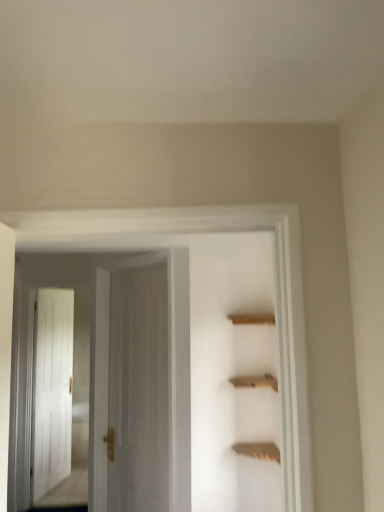
Question: From a real-world perspective, is white wooden door at center, the second door positioned from the back, positioned under wooden shelf at upper center based on gravity?

Choices:
 (A) no
 (B) yes

Answer: (A)

Question: Is white wooden door at center, the second door positioned from the back, far from wooden shelf at upper center?

Choices:
 (A) yes
 (B) no

Answer: (B)

Question: From the image's perspective, would you say white wooden door at center, the second door positioned from the back, is shown under wooden shelf at upper center?

Choices:
 (A) yes
 (B) no

Answer: (B)

Question: Does white wooden door at center, the second door positioned from the back, lie in front of wooden shelf at upper center?

Choices:
 (A) no
 (B) yes

Answer: (B)

Question: Does white wooden door at center, placed as the 1th door when sorted from front to back, have a lesser width compared to wooden shelf at upper center?

Choices:
 (A) no
 (B) yes

Answer: (B)

Question: Does point (231, 382) appear closer or farther from the camera than point (34, 275)?

Choices:
 (A) farther
 (B) closer

Answer: (B)

Question: In terms of width, does wooden shelf at upper center look wider or thinner when compared to white wooden door at center, the second door positioned from the back?

Choices:
 (A) thin
 (B) wide

Answer: (B)

Question: Is wooden shelf at upper center taller or shorter than white wooden door at center, placed as the 1th door when sorted from front to back?

Choices:
 (A) short
 (B) tall

Answer: (A)

Question: Visually, is wooden shelf at upper center positioned to the left or to the right of white wooden door at center, placed as the 1th door when sorted from front to back?

Choices:
 (A) right
 (B) left

Answer: (A)

Question: From their relative heights in the image, would you say white wooden door at center, placed as the 1th door when sorted from front to back, is taller or shorter than wooden shelf at upper center?

Choices:
 (A) short
 (B) tall

Answer: (B)

Question: Considering the positions of white wooden door at center, placed as the 1th door when sorted from front to back, and wooden shelf at upper center in the image, is white wooden door at center, placed as the 1th door when sorted from front to back, wider or thinner than wooden shelf at upper center?

Choices:
 (A) wide
 (B) thin

Answer: (B)

Question: From a real-world perspective, relative to wooden shelf at upper center, is white wooden door at center, the second door positioned from the back, vertically above or below?

Choices:
 (A) above
 (B) below

Answer: (A)

Question: Considering the positions of point (175, 464) and point (271, 450), is point (175, 464) closer or farther from the camera than point (271, 450)?

Choices:
 (A) closer
 (B) farther

Answer: (B)

Question: Is white glossy door at center, positioned as the first door in back-to-front order, spatially inside white wooden door at center, placed as the 1th door when sorted from front to back, or outside of it?

Choices:
 (A) outside
 (B) inside

Answer: (A)

Question: Based on their positions, is white glossy door at center, positioned as the first door in back-to-front order, located to the left or right of white wooden door at center, placed as the 1th door when sorted from front to back?

Choices:
 (A) left
 (B) right

Answer: (A)